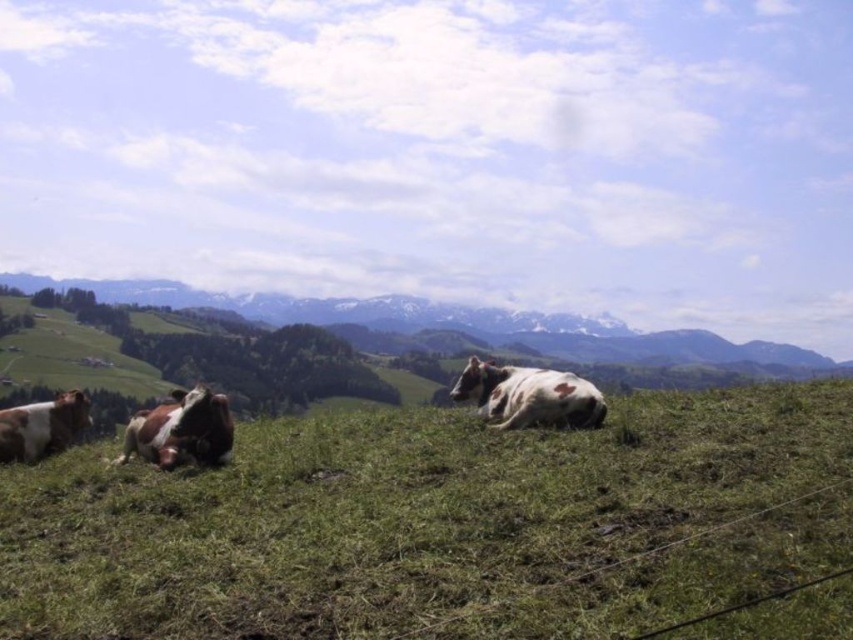
Does green grassy field at center lie behind white and brown spotted cow at left?

No, it is in front of white and brown spotted cow at left.

Between green grassy field at center and white and brown spotted cow at left, which one has more height?

With more height is white and brown spotted cow at left.

Is point (480, 554) positioned behind point (9, 410)?

No, it is not.

Image resolution: width=853 pixels, height=640 pixels. Identify the location of green grassy field at center. (439, 524).

Between point (732, 518) and point (587, 397), which one is positioned behind?

The point (587, 397) is more distant.

Is green grassy field at center above white spotted cow at center?

No.

Locate an element on the screen. The height and width of the screenshot is (640, 853). green grassy field at center is located at coordinates (439, 524).

Is white spotted cow at center wider than white and brown spotted cow at left?

Indeed, white spotted cow at center has a greater width compared to white and brown spotted cow at left.

Which of these two, white spotted cow at center or white and brown spotted cow at left, stands taller?

white and brown spotted cow at left is taller.

Is point (519, 387) closer to viewer compared to point (27, 419)?

Yes, it is.

This screenshot has width=853, height=640. Find the location of `white spotted cow at center`. white spotted cow at center is located at coordinates (529, 396).